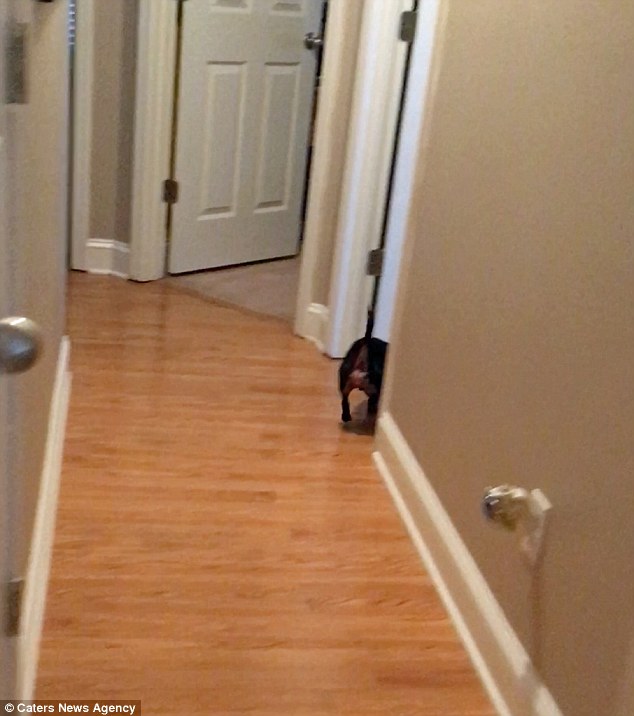
Locate an element on the screen. This screenshot has width=634, height=716. wallsocket is located at coordinates (533, 548).